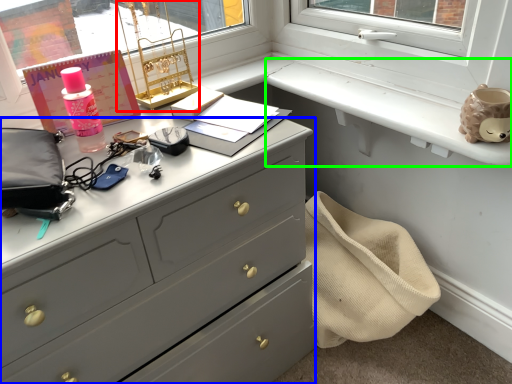
Question: Which is farther away from table lamp (highlighted by a red box)? chest of drawers (highlighted by a blue box) or window sill (highlighted by a green box)?

Choices:
 (A) chest of drawers
 (B) window sill

Answer: (A)